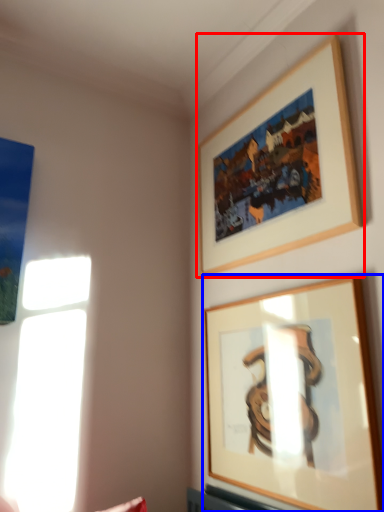
Question: Which object is closer to the camera taking this photo, picture frame (highlighted by a red box) or picture frame (highlighted by a blue box)?

Choices:
 (A) picture frame
 (B) picture frame

Answer: (B)